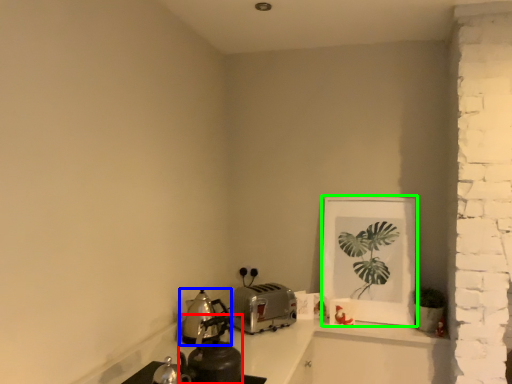
Question: Based on their relative distances, which object is farther from tea pot (highlighted by a red box)? Choose from kitchen appliance (highlighted by a blue box) and picture frame (highlighted by a green box).

Choices:
 (A) kitchen appliance
 (B) picture frame

Answer: (B)